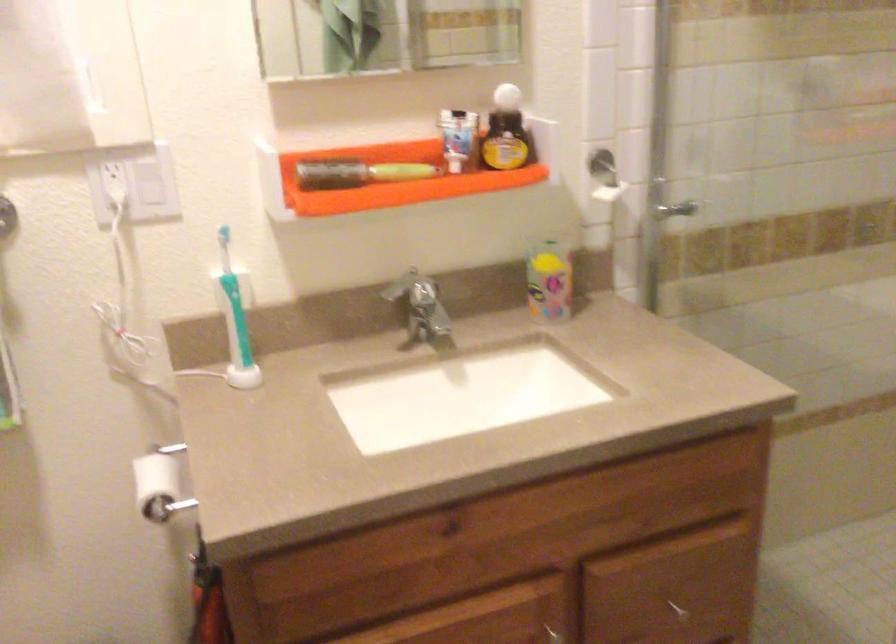
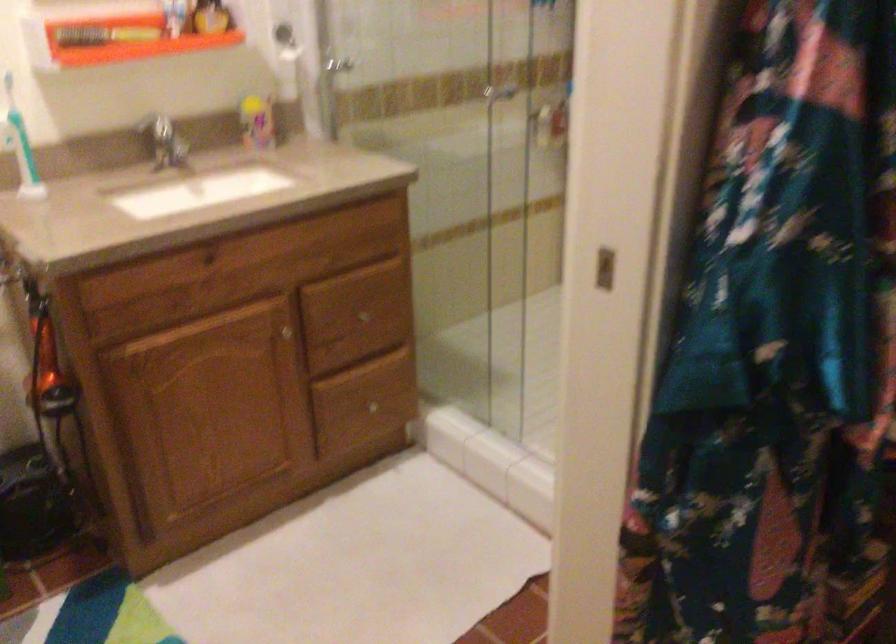
Question: The camera is either moving clockwise (left) or counter-clockwise (right) around the object. The first image is from the beginning of the video and the second image is from the end. Is the camera moving left or right when shooting the video?

Choices:
 (A) Left
 (B) Right

Answer: (A)